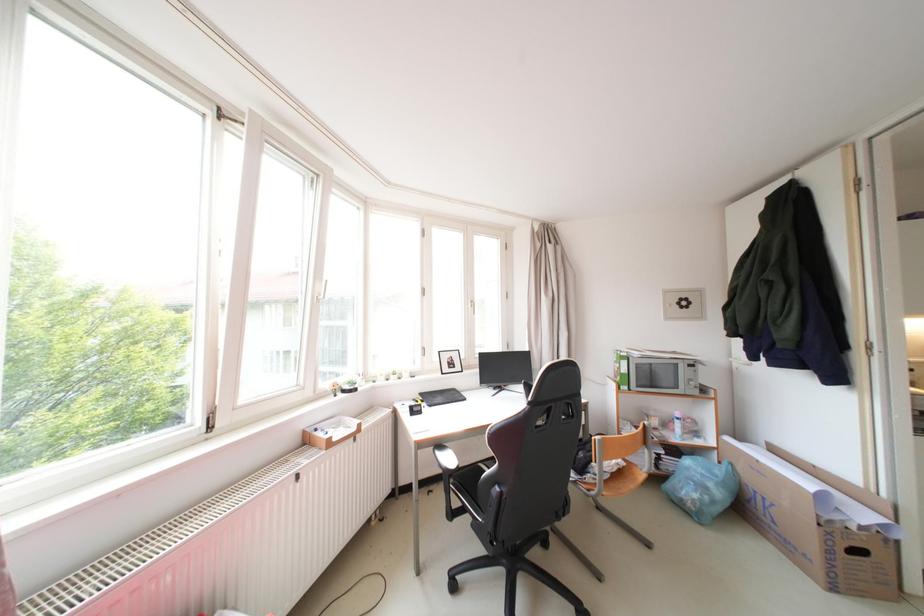
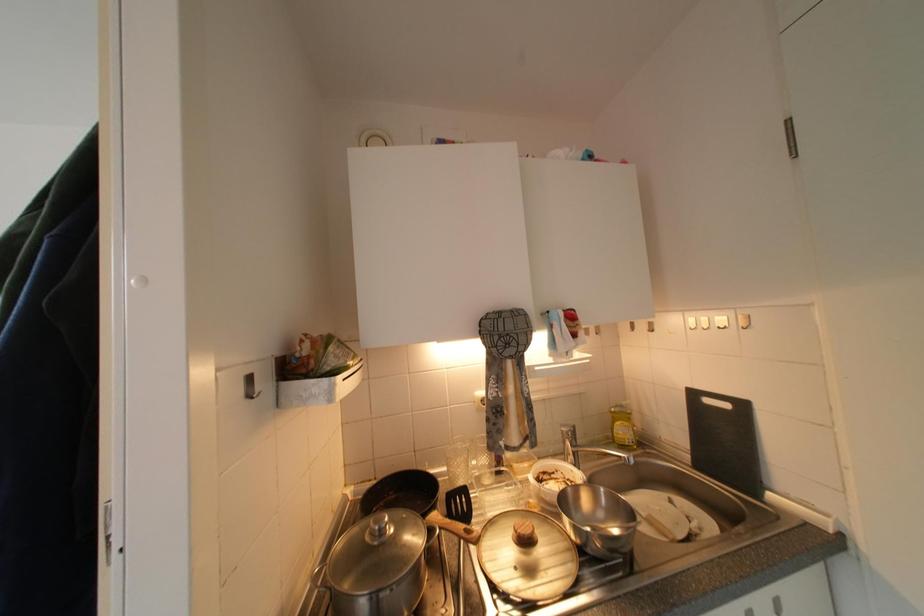
Question: In a continuous first-person perspective shot, in which direction is the camera moving?

Choices:
 (A) Left
 (B) Right
 (C) Forward
 (D) Backward

Answer: (B)